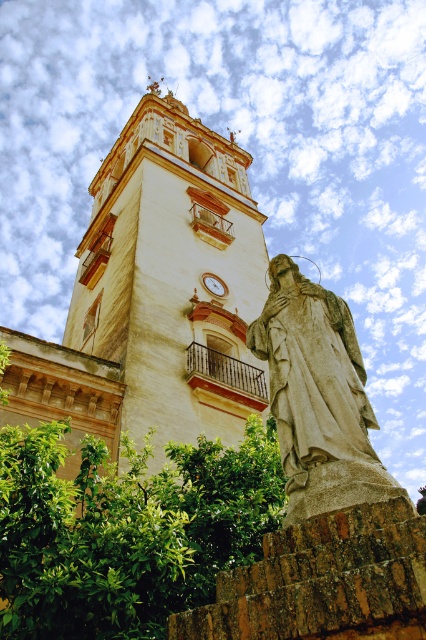
You are an architect examining the image of a historic site. You notice the beige stone tower at center and the gold metallic clock at center. Based on their positions, which object is closer to the right side of the image?

The gold metallic clock at center is closer to the right side of the image because the beige stone tower at center is to the left of it.

You are an architect examining the tower and its surroundings. You notice the stone statue at center and the gold metallic clock at center. From the perspective of someone standing directly in front of the tower, which object is positioned to the right?

The stone statue at center is to the right of the gold metallic clock at center, so from the front view, the stone statue at center is on the right side.

You are an architect examining the beige stone tower at center and the gold metallic clock at center. Which object would require more materials to construct based on their sizes?

The beige stone tower at center is bigger than the gold metallic clock at center, so it would require more materials to construct.